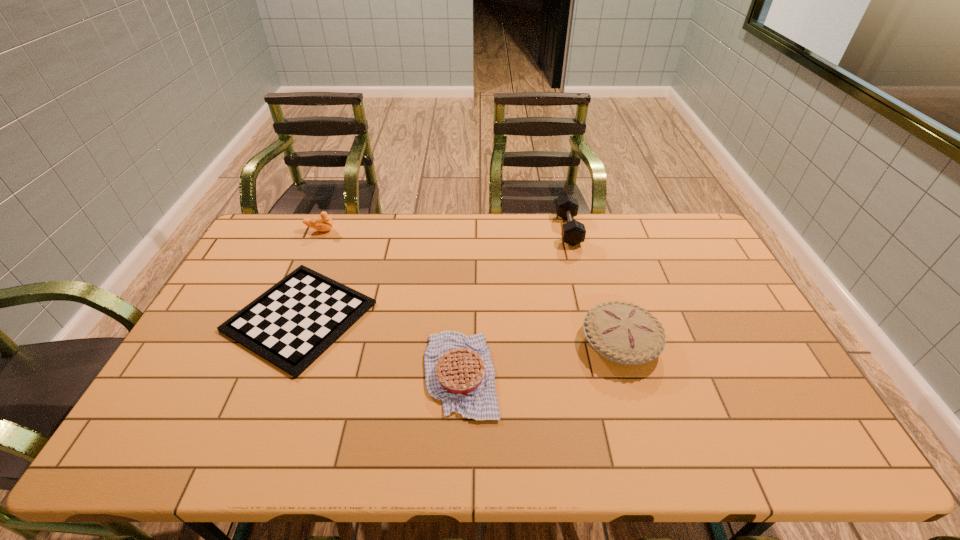
Locate an element on the screen. The image size is (960, 540). vacant area that lies between the third object from right to left and the dumbbell is located at coordinates (515, 302).

This screenshot has width=960, height=540. I want to click on empty location between the taller pie and the dumbbell, so click(594, 286).

The image size is (960, 540). What are the coordinates of `free space between the shorter pie and the taller pie` in the screenshot? It's located at (540, 357).

Locate an element on the screen. empty location between the dumbbell and the taller pie is located at coordinates (594, 286).

Where is `blank region between the shorter pie and the duckling`? The height and width of the screenshot is (540, 960). blank region between the shorter pie and the duckling is located at coordinates 391,302.

You are a GUI agent. You are given a task and a screenshot of the screen. Output one action in this format:
    pyautogui.click(x=<x>, y=<y>)
    Task: Click on the vacant area between the dumbbell and the right pie
    This screenshot has height=540, width=960.
    Given the screenshot: What is the action you would take?
    tap(594, 286)

Where is `vacant space that is in between the right pie and the shortest object`? vacant space that is in between the right pie and the shortest object is located at coordinates (460, 329).

What are the coordinates of `vacant area that lies between the shortest object and the dumbbell` in the screenshot? It's located at (434, 273).

In order to click on unoccupied area between the duckling and the fourth tallest object in this screenshot , I will do tap(391, 302).

You are a GUI agent. You are given a task and a screenshot of the screen. Output one action in this format:
    pyautogui.click(x=<x>, y=<y>)
    Task: Click on the second closest object to the checkerboard
    
    Given the screenshot: What is the action you would take?
    pyautogui.click(x=324, y=223)